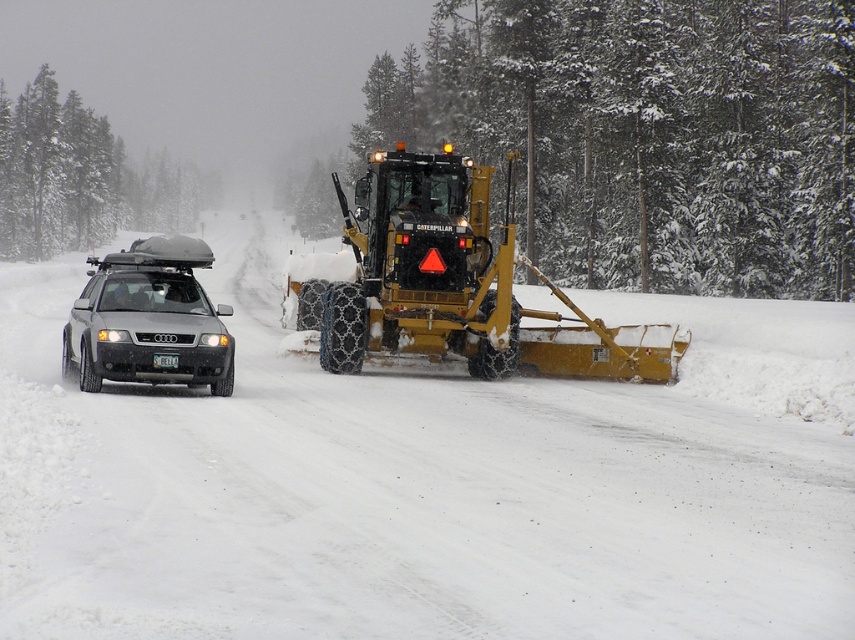
Based on the photo, you are a driver approaching the road where the snowplow is working. You see the matte black car at left and the white plastic license plate at center. Which object is bigger?

The matte black car at left is larger in size compared to the white plastic license plate at center.

You are a driver approaching the yellow metallic snowplow at center and the white plastic license plate at center in the snowy road. Which object is taller?

The yellow metallic snowplow at center is much taller than the white plastic license plate at center.